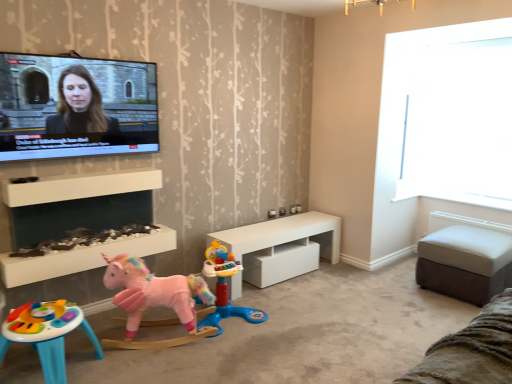
Where is `vacant space that is in between white leather ottoman at right, which is the first table in right-to-left order, and white glossy table at center, the 2th table positioned from the right`? This screenshot has width=512, height=384. vacant space that is in between white leather ottoman at right, which is the first table in right-to-left order, and white glossy table at center, the 2th table positioned from the right is located at coordinates (361, 286).